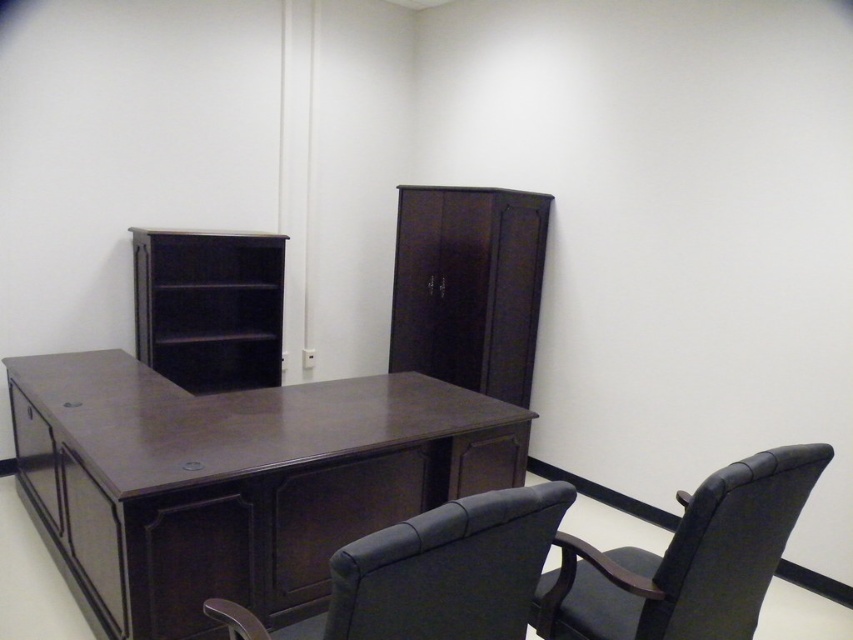
Question: Based on their relative distances, which object is nearer to the dark wood/finish computer desk at center?

Choices:
 (A) leather-like black chair at center
 (B) dark wood drawer at lower left

Answer: (B)

Question: Is dark wood bookshelf at upper left bigger than dark wood drawer at lower left?

Choices:
 (A) yes
 (B) no

Answer: (A)

Question: Can you confirm if black leather chair at lower right is thinner than dark wood bookshelf at upper left?

Choices:
 (A) yes
 (B) no

Answer: (A)

Question: Which object appears farthest from the camera in this image?

Choices:
 (A) dark wood drawer at lower left
 (B) dark wood/finish computer desk at center
 (C) leather-like black chair at center
 (D) black leather chair at lower right

Answer: (A)

Question: Estimate the real-world distances between objects in this image. Which object is farther from the dark wood/finish computer desk at center?

Choices:
 (A) dark wood bookshelf at upper left
 (B) dark wood drawer at lower left

Answer: (A)

Question: Is black leather chair at lower right thinner than leather-like black chair at center?

Choices:
 (A) no
 (B) yes

Answer: (A)